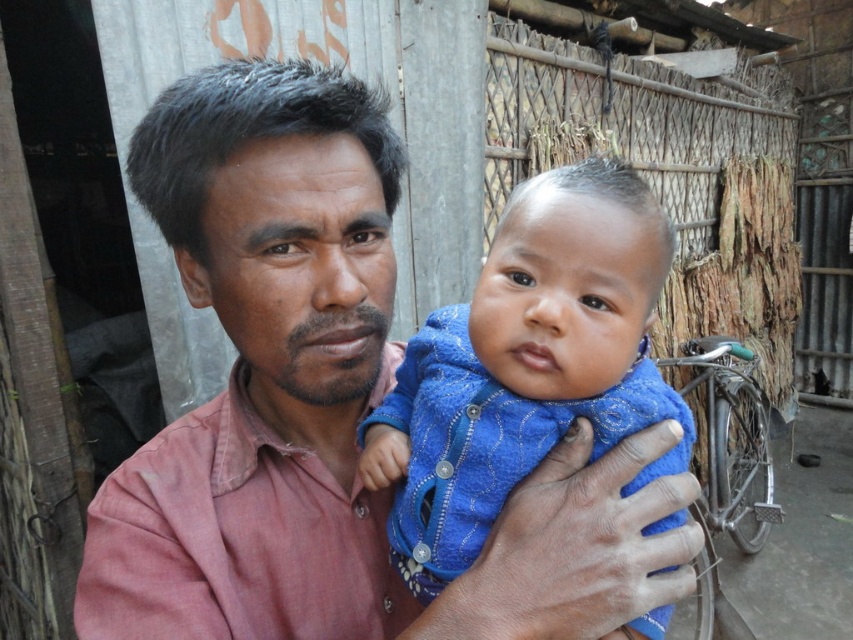
Who is positioned more to the right, pink cotton shirt at center or blue textured cloth at center?

Positioned to the right is blue textured cloth at center.

Is point (189, 291) behind point (421, 387)?

No, it is not.

Which is behind, point (554, 557) or point (532, 360)?

The point (532, 360) is behind.

The image size is (853, 640). In order to click on pink cotton shirt at center in this screenshot , I will do point(328,406).